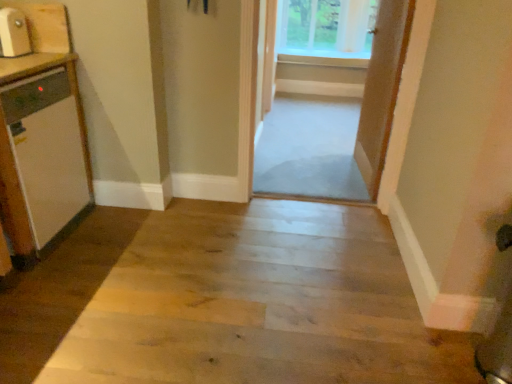
What are the coordinates of `free spot to the right of matte wood microwave at left, which appears as the 2th appliance when ordered from the bottom` in the screenshot? It's located at (38, 51).